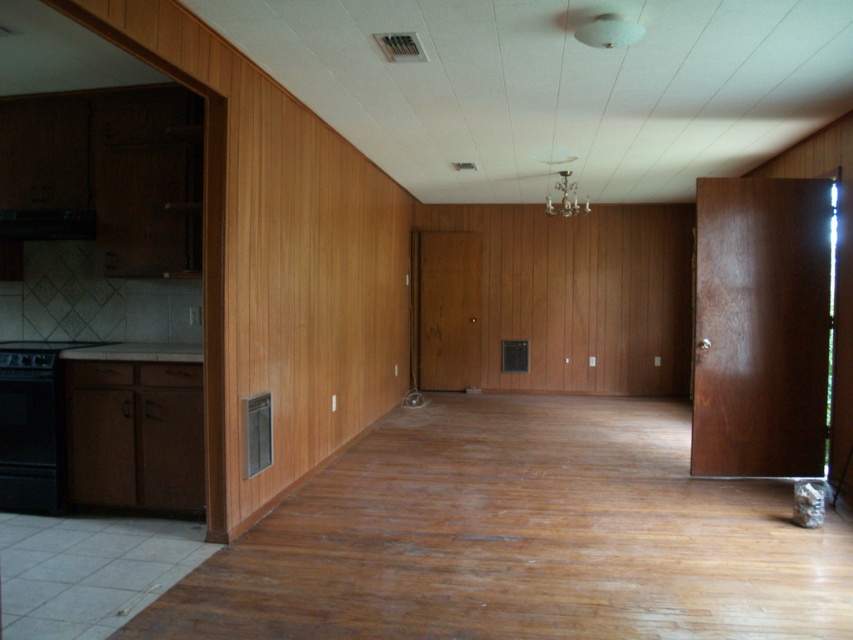
Question: Which of the following is the closest to the observer?

Choices:
 (A) (22, 499)
 (B) (0, 212)

Answer: (A)

Question: Is black matte oven at left wider than black matte exhaust hood at left?

Choices:
 (A) yes
 (B) no

Answer: (B)

Question: Does black matte oven at left appear over black matte exhaust hood at left?

Choices:
 (A) yes
 (B) no

Answer: (B)

Question: Which object appears farthest from the camera in this image?

Choices:
 (A) black matte exhaust hood at left
 (B) black matte oven at left

Answer: (A)

Question: Among these points, which one is farthest from the camera?

Choices:
 (A) (19, 394)
 (B) (90, 225)

Answer: (B)

Question: Is black matte oven at left positioned behind black matte exhaust hood at left?

Choices:
 (A) yes
 (B) no

Answer: (B)